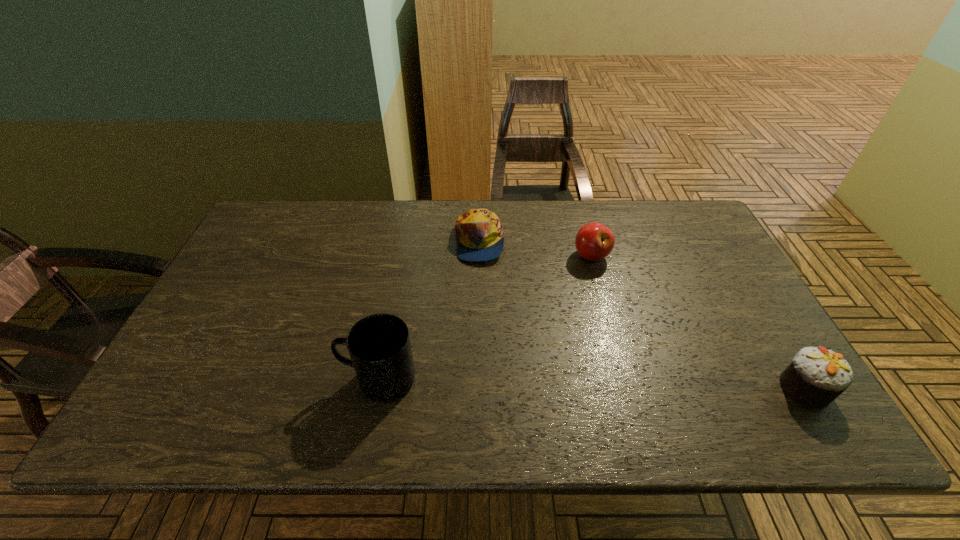
The width and height of the screenshot is (960, 540). What are the coordinates of `object at the right edge` in the screenshot? It's located at (816, 377).

Image resolution: width=960 pixels, height=540 pixels. What are the coordinates of `object that is at the near right corner` in the screenshot? It's located at (816, 377).

The width and height of the screenshot is (960, 540). In the image, there is a desktop. What are the coordinates of `vacant space at the far edge` in the screenshot? It's located at (523, 242).

The width and height of the screenshot is (960, 540). In the image, there is a desktop. Find the location of `vacant region at the left edge`. vacant region at the left edge is located at coordinates (275, 280).

At what (x,y) coordinates should I click in order to perform the action: click on free region at the right edge of the desktop. Please return your answer as a coordinate pair (x, y). Image resolution: width=960 pixels, height=540 pixels. Looking at the image, I should click on (684, 281).

I want to click on free space at the far left corner of the desktop, so click(x=264, y=236).

In order to click on free spot at the far right corner of the desktop in this screenshot , I will do `click(688, 235)`.

Identify the location of vacant space in between the apple and the tallest object. The height and width of the screenshot is (540, 960). (486, 318).

Find the location of a particular element. This screenshot has height=540, width=960. empty space between the rightmost object and the cap is located at coordinates (642, 315).

Image resolution: width=960 pixels, height=540 pixels. Find the location of `vacant space that's between the apple and the shortest object`. vacant space that's between the apple and the shortest object is located at coordinates (536, 249).